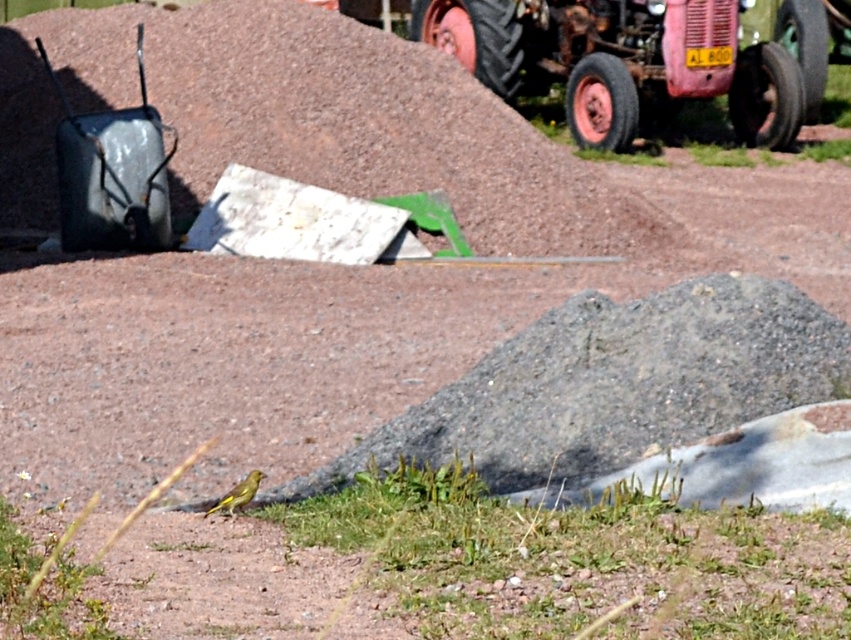
You are a farmer who needs to move the rusty metal tractor at upper center and the metallic gray wheelbarrow at left. Which one would be harder to move due to its size?

The rusty metal tractor at upper center is larger in size than the metallic gray wheelbarrow at left, so it would be harder to move.

You are a construction worker who needs to move the rusty metal tractor at upper center to the brown gravel mound at upper center. Given that your tractor can only move in straight lines and has a maximum reach of 5 meters, can you move it directly without needing to adjust its position first?

The distance between the rusty metal tractor at upper center and the brown gravel mound at upper center is 4.66 meters, which is within the tractor tractor tractor tractor tractor tractor tractor tractor tractor tractor tractor tractor tractor tractor tractor tractor tractor tractor tractor tractor tractor tractor tractor tractor tractor tractor tractor tractor tractor tractor tractor tractor tractor tractor tractor tractor tractor tractor tractor tractor tractor tractor tractor tractor tractor tractor 4.66